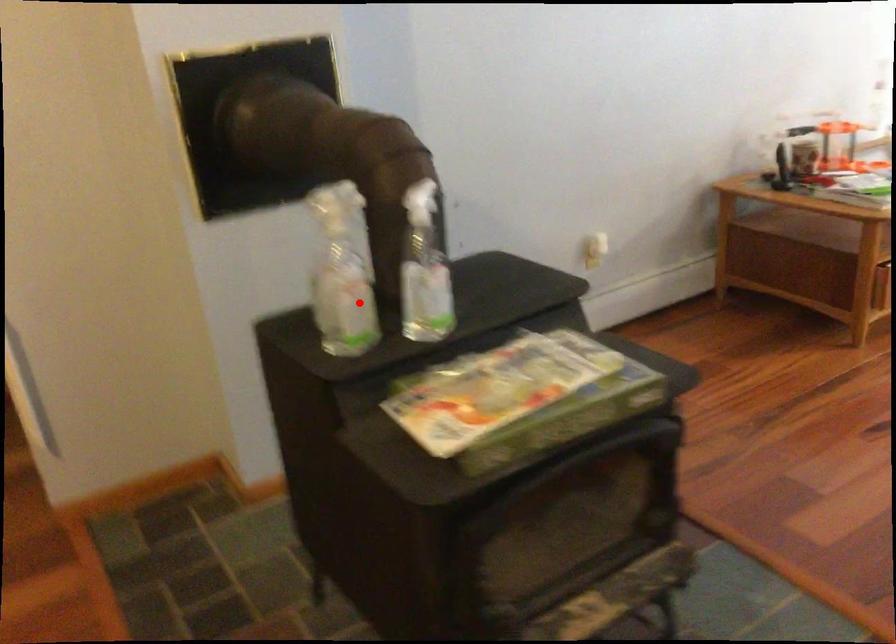
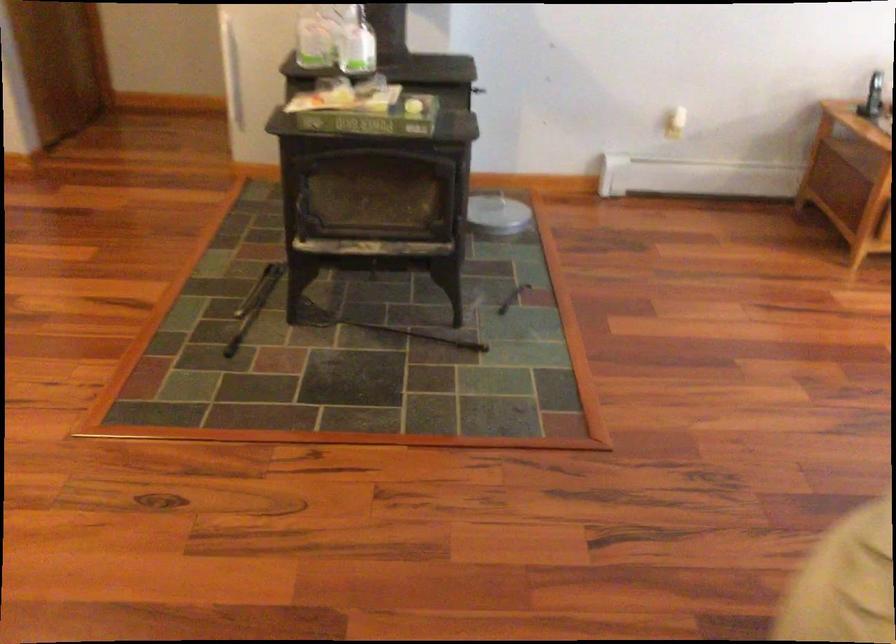
Question: I am providing you with two images of the same scene from different viewpoints. A red point is shown in image1. For the corresponding object point in image2, is it positioned nearer or farther from the camera?

Choices:
 (A) Nearer
 (B) Farther

Answer: (B)